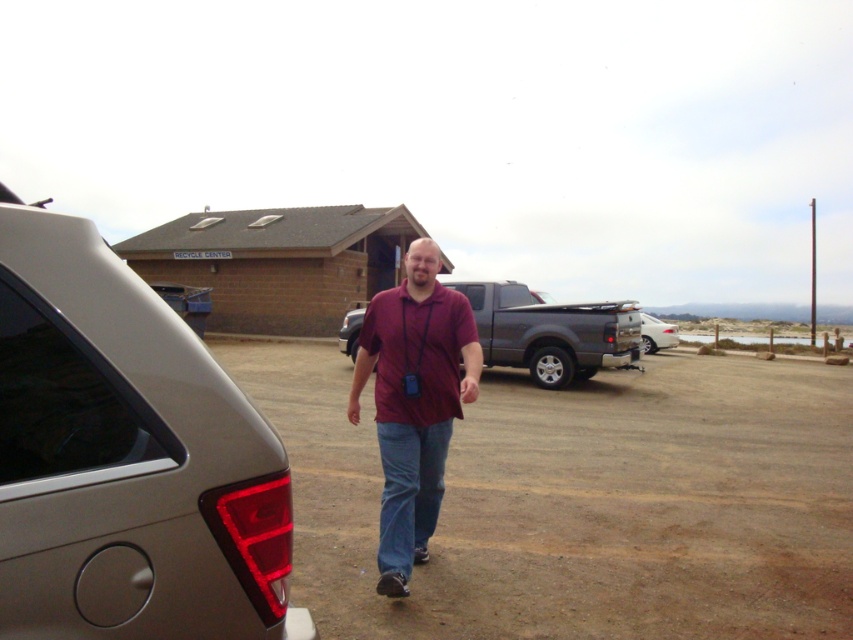
Is maroon fabric shirt at center positioned behind matte black suv at center?

No, maroon fabric shirt at center is in front of matte black suv at center.

Which of these two, maroon fabric shirt at center or matte black suv at center, stands shorter?

Standing shorter between the two is maroon fabric shirt at center.

The height and width of the screenshot is (640, 853). What do you see at coordinates (415, 403) in the screenshot?
I see `maroon fabric shirt at center` at bounding box center [415, 403].

I want to click on maroon fabric shirt at center, so click(415, 403).

Which is behind, point (74, 561) or point (399, 563)?

The point (399, 563) is more distant.

Between satin metallic car at left and maroon fabric shirt at center, which one has less height?

satin metallic car at left

Identify the location of satin metallic car at left. The height and width of the screenshot is (640, 853). (126, 458).

This screenshot has height=640, width=853. In order to click on satin metallic car at left in this screenshot , I will do `click(126, 458)`.

Can you confirm if matte black suv at center is smaller than denim at center?

No.

Who is more distant from viewer, (624, 342) or (402, 460)?

Point (624, 342)

This screenshot has width=853, height=640. I want to click on matte black suv at center, so click(550, 332).